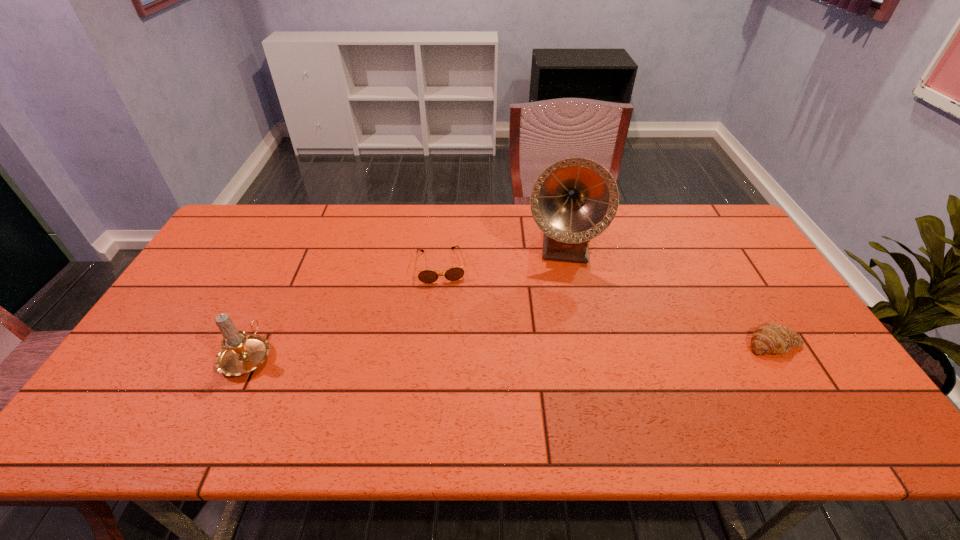
Image resolution: width=960 pixels, height=540 pixels. I want to click on vacant space on the desktop that is between the third shortest object and the crescent roll and is positioned on the horn of the third object from left to right, so click(561, 348).

This screenshot has width=960, height=540. Find the location of `free spot on the desktop that is between the leftmost object and the rightmost object and is positioned on the front-facing side of the second object from left to right`. free spot on the desktop that is between the leftmost object and the rightmost object and is positioned on the front-facing side of the second object from left to right is located at coordinates (452, 350).